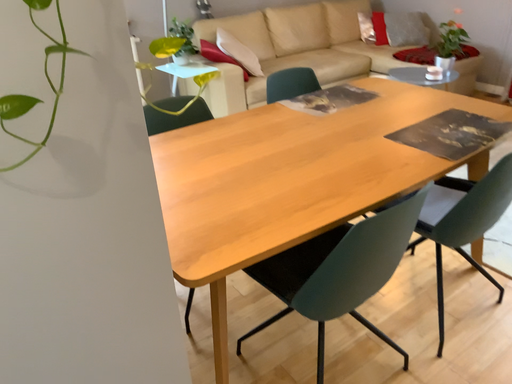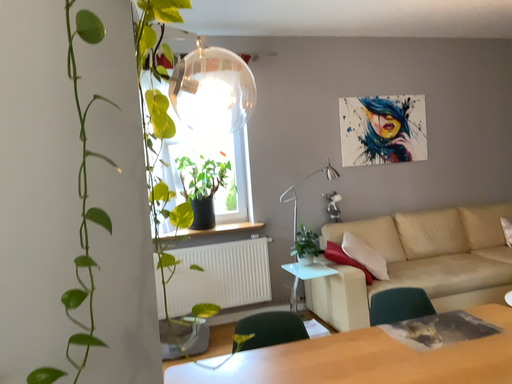
Question: Which way did the camera rotate in the video?

Choices:
 (A) rotated right
 (B) rotated left

Answer: (B)